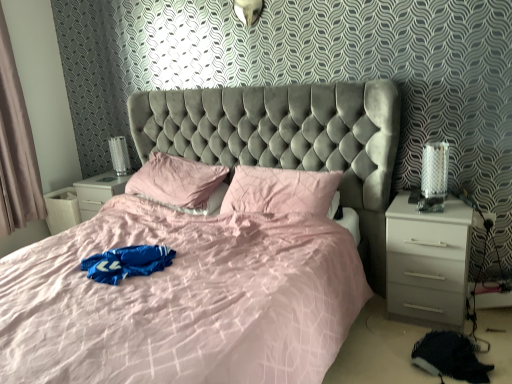
You are a GUI agent. You are given a task and a screenshot of the screen. Output one action in this format:
    pyautogui.click(x=<x>, y=<y>)
    Task: Click on the empty space that is ontop of white glossy nightstand at right
    
    Given the screenshot: What is the action you would take?
    pyautogui.click(x=429, y=204)